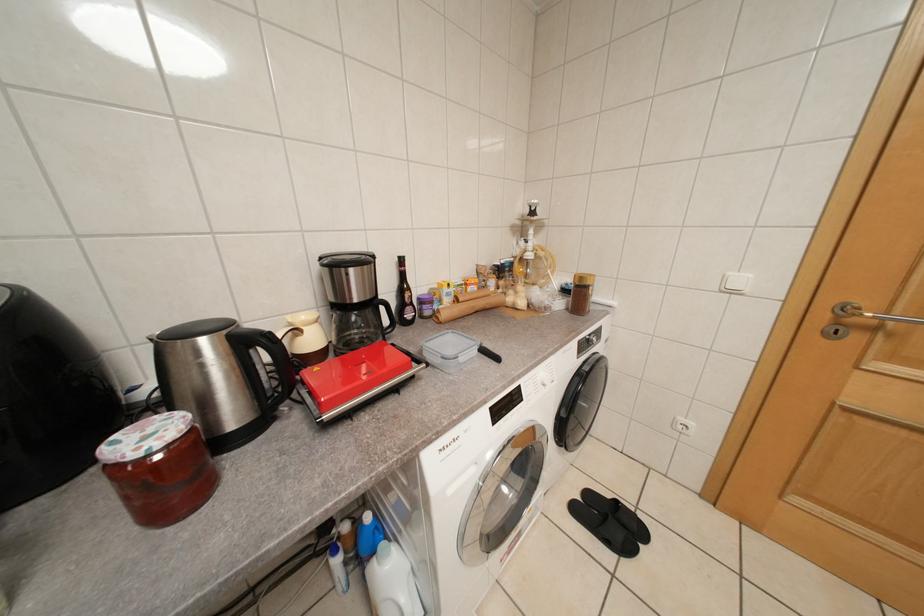
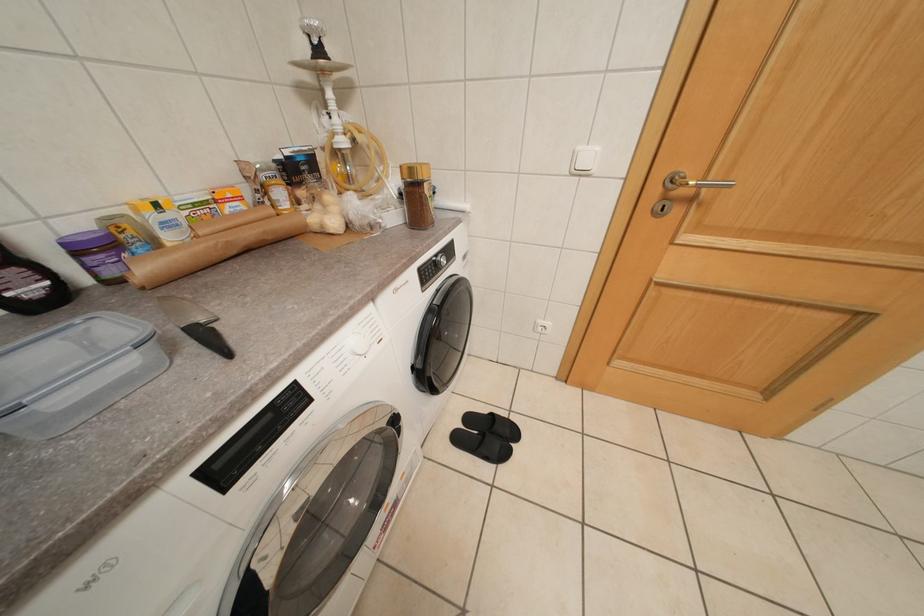
Based on the continuous images, in which direction is the camera rotating?

The rotation direction of the camera is right-down.